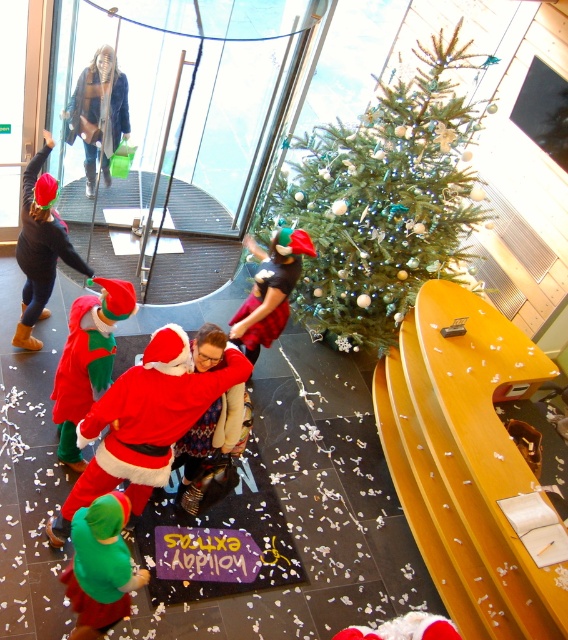
Question: Which object is closer to the camera taking this photo?

Choices:
 (A) matte black jacket at upper left
 (B) green matte christmas tree at center

Answer: (B)

Question: Estimate the real-world distances between objects in this image. Which object is farther from the matte black jacket at upper left?

Choices:
 (A) fuzzy red santa at center
 (B) velvet green elf at center
 (C) matte black outfit at left

Answer: (A)

Question: Can you confirm if green matte christmas tree at center is positioned to the left of matte black outfit at left?

Choices:
 (A) yes
 (B) no

Answer: (B)

Question: Can you confirm if matte black outfit at left is thinner than matte black jacket at upper left?

Choices:
 (A) no
 (B) yes

Answer: (A)

Question: Is matte black outfit at left to the left of matte black jacket at upper left from the viewer's perspective?

Choices:
 (A) no
 (B) yes

Answer: (B)

Question: Which point is farther to the camera?

Choices:
 (A) (65, 417)
 (B) (431, 104)
 (C) (52, 140)
 (D) (90, 72)

Answer: (D)